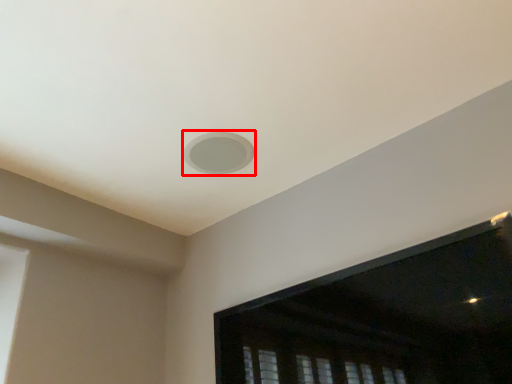
Question: From the image's perspective, where is hole (annotated by the red box) located in relation to window screen in the image?

Choices:
 (A) below
 (B) above

Answer: (B)